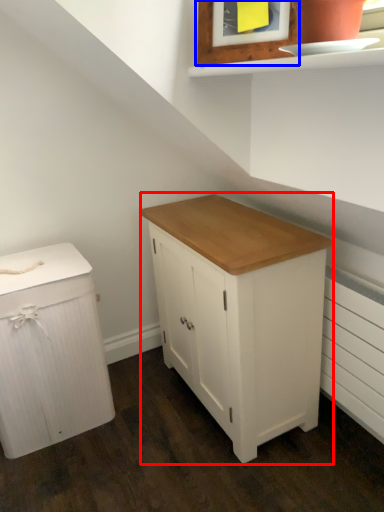
Question: Which of the following is the closest to the observer, chest of drawers (highlighted by a red box) or picture frame (highlighted by a blue box)?

Choices:
 (A) chest of drawers
 (B) picture frame

Answer: (B)